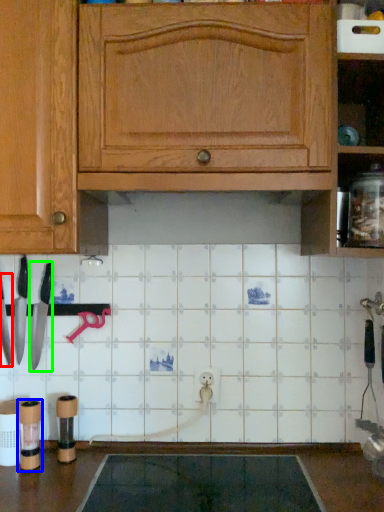
Question: Which is nearer to the knife (highlighted by a red box)? appliance (highlighted by a blue box) or knife (highlighted by a green box).

Choices:
 (A) appliance
 (B) knife

Answer: (B)